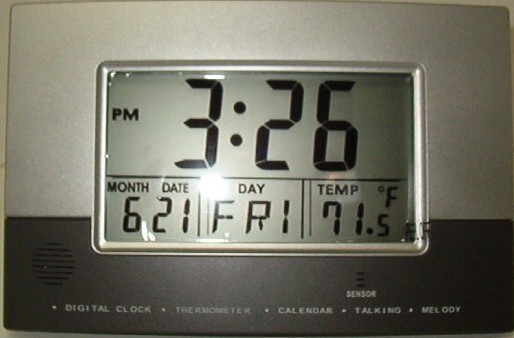
Locate an element on the screen. sound outlet is located at coordinates (60, 266).